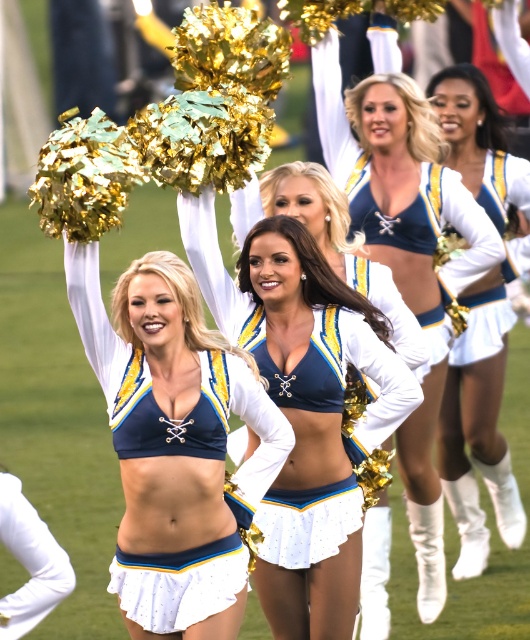
Can you confirm if blue satin cheerleader at center is smaller than white matte uniform at center?

Actually, blue satin cheerleader at center might be larger than white matte uniform at center.

Is blue satin cheerleader at center bigger than white matte uniform at center?

Yes, blue satin cheerleader at center is bigger than white matte uniform at center.

Between point (388, 157) and point (494, 332), which one is positioned in front?

Point (388, 157) is in front.

Where is `blue satin cheerleader at center`? The height and width of the screenshot is (640, 530). blue satin cheerleader at center is located at coordinates (404, 244).

Is point (334, 164) positioned behind point (480, 336)?

No.

Does blue satin cheerleader at center come behind white matte skirt at center?

No.

Locate an element on the screen. blue satin cheerleader at center is located at coordinates (404, 244).

This screenshot has height=640, width=530. Identify the location of white matte uniform at center. (479, 426).

In the scene shown: Is white matte uniform at center to the left of white matte uniform at lower left from the viewer's perspective?

In fact, white matte uniform at center is to the right of white matte uniform at lower left.

Does point (478, 534) lie behind point (3, 532)?

Yes, it is.

You are a GUI agent. You are given a task and a screenshot of the screen. Output one action in this format:
    pyautogui.click(x=<x>, y=<y>)
    Task: Click on the white matte uniform at center
    The image size is (530, 640).
    Given the screenshot: What is the action you would take?
    pyautogui.click(x=479, y=426)